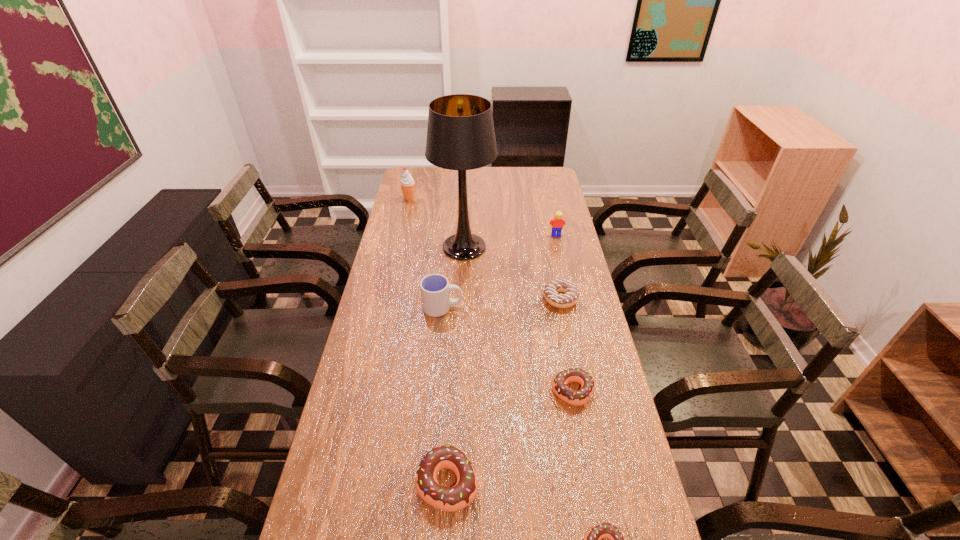
At what (x,y) coordinates should I click in order to perform the action: click on chocolate doughnut. Please return your answer as a coordinate pair (x, y). This screenshot has height=540, width=960. Looking at the image, I should click on (570, 297).

Locate an element on the screen. vacant region located 0.250m on the right of the table lamp is located at coordinates (560, 247).

In order to click on vacant region located on the right of the farthest object in this screenshot , I will do `click(474, 199)`.

This screenshot has height=540, width=960. I want to click on vacant space positioned on the front-facing side of the Lego, so click(x=559, y=245).

The height and width of the screenshot is (540, 960). Find the location of `vacant area located with the handle on the side of the cup`. vacant area located with the handle on the side of the cup is located at coordinates (546, 307).

Where is `free space located 0.360m on the right of the biggest brown doughnut`? free space located 0.360m on the right of the biggest brown doughnut is located at coordinates (632, 482).

I want to click on blank area located 0.210m on the left of the farthest brown doughnut, so coord(475,391).

In order to click on free region located 0.370m on the front of the farthest doughnut in this screenshot , I will do `click(583, 410)`.

Locate an element on the screen. This screenshot has height=540, width=960. object positioned at the left edge is located at coordinates (407, 183).

Find the location of a particular element. The image size is (960, 540). Lego located at the right edge is located at coordinates (557, 223).